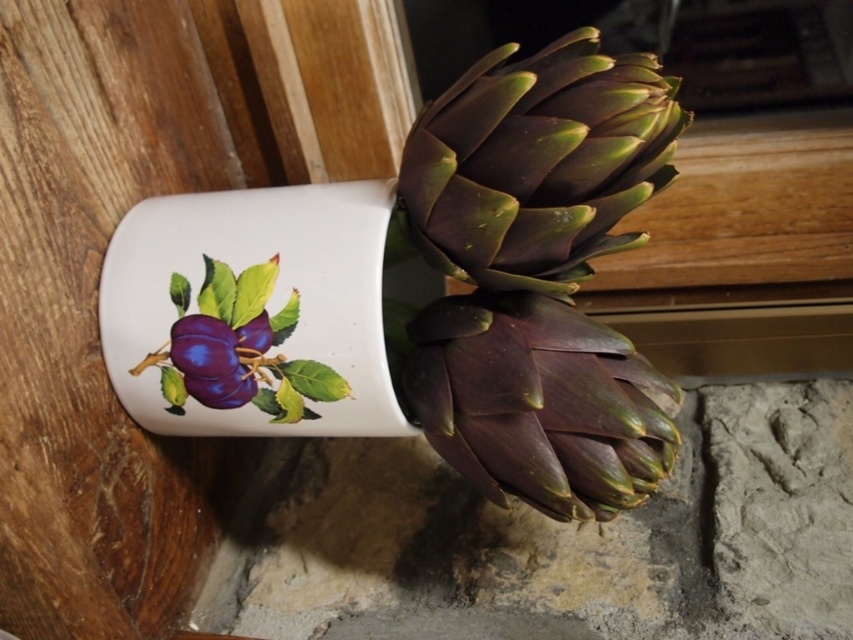
You are a photographer setting up a close shot of the dark green leafy artichoke at center. If your camera can focus on objects within 3 feet, will it be able to capture the artichoke clearly?

The dark green leafy artichoke at center is 3.57 feet away from the camera, which is beyond the 3 feet focus range. Therefore, the camera may not capture it clearly unless adjusted.

You are arranging a still life setup and want to ensure proper lighting for both the dark purple leafy artichoke at center and the matte purple plum at center. Since the lighting is coming from above, which object will cast a longer shadow?

The dark purple leafy artichoke at center is positioned under the matte purple plum at center, so the plum will cast a shadow on the artichoke. Therefore, the artichoke will not cast a longer shadow because it is beneath the plum, which blocks its shadow from extending further.

You are holding a magnifying glass and want to examine both the dark green leafy artichoke at center and the matte purple plum at center. Which object should you focus on first to ensure you don

The dark green leafy artichoke at center is closer to the viewer than the matte purple plum at center, so you should focus on the dark green leafy artichoke at center first to examine it properly.